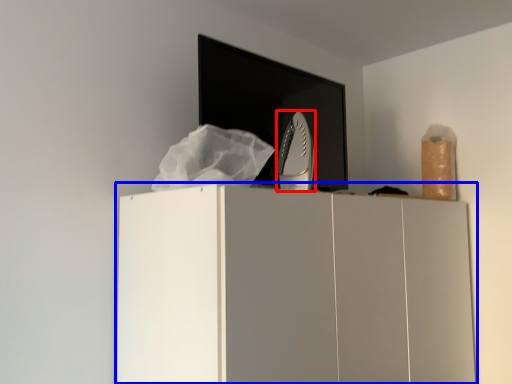
Question: Which point is further to the camera, home appliance (highlighted by a red box) or cupboard (highlighted by a blue box)?

Choices:
 (A) home appliance
 (B) cupboard

Answer: (A)